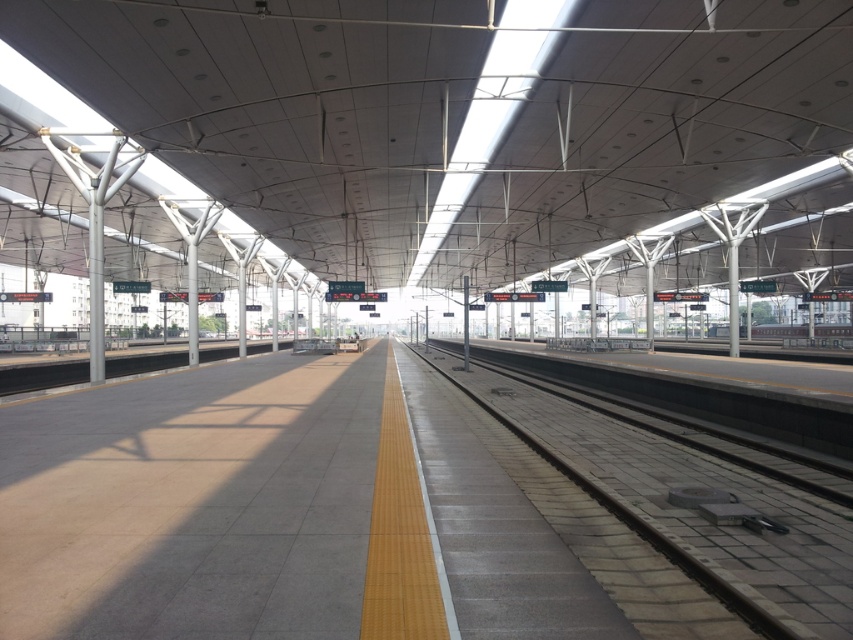
Who is lower down, gray concrete train track at center or silver metallic train at center?

gray concrete train track at center is below.

Is gray concrete train track at center shorter than silver metallic train at center?

Yes.

Does point (628, 484) lie behind point (712, 332)?

No.

Locate an element on the screen. The width and height of the screenshot is (853, 640). gray concrete train track at center is located at coordinates (693, 508).